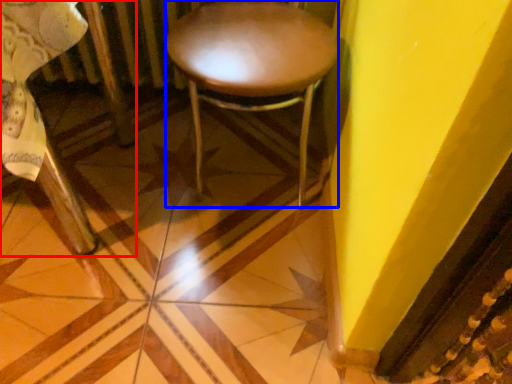
Question: Which object is further to the camera taking this photo, chair (highlighted by a red box) or stool (highlighted by a blue box)?

Choices:
 (A) chair
 (B) stool

Answer: (B)